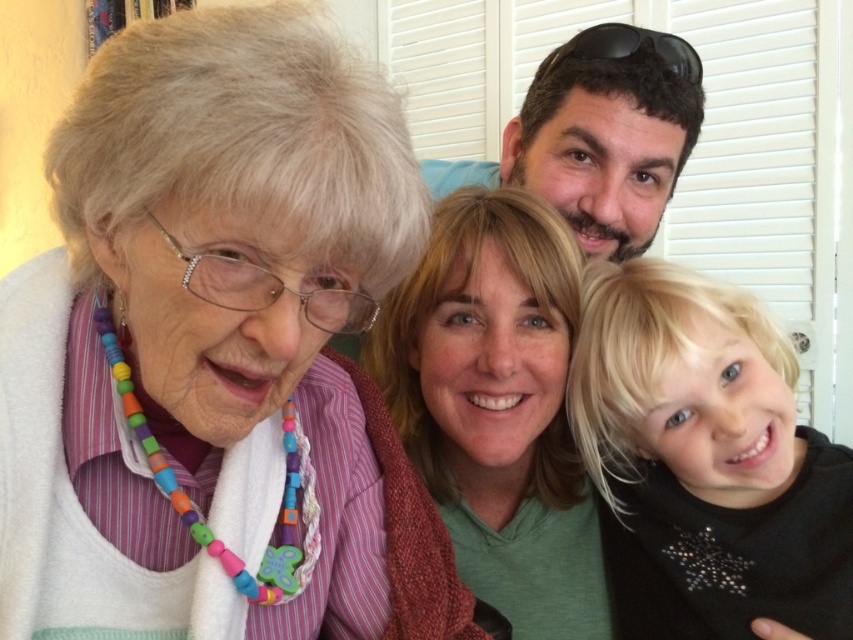
Can you confirm if blonde hair at lower right is taller than multicolored beaded necklace at upper left?

No, blonde hair at lower right is not taller than multicolored beaded necklace at upper left.

Does blonde hair at lower right have a lesser height compared to multicolored beaded necklace at upper left?

Yes.

Where is `blonde hair at lower right`? blonde hair at lower right is located at coordinates [x=705, y=461].

Who is shorter, white beaded necklace at upper left or blonde hair at lower right?

blonde hair at lower right is shorter.

The width and height of the screenshot is (853, 640). I want to click on white beaded necklace at upper left, so click(x=215, y=342).

Locate an element on the screen. white beaded necklace at upper left is located at coordinates (215, 342).

Does white beaded necklace at upper left appear under multicolored beaded necklace at upper left?

Actually, white beaded necklace at upper left is above multicolored beaded necklace at upper left.

Between point (399, 179) and point (440, 374), which one is positioned behind?

The point (440, 374) is more distant.

Which is in front, point (173, 16) or point (485, 326)?

Point (173, 16) is more forward.

Locate an element on the screen. white beaded necklace at upper left is located at coordinates (215, 342).